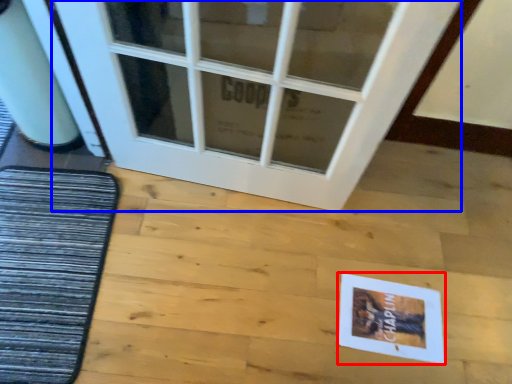
Question: Which point is closer to the camera, postcard (highlighted by a red box) or door (highlighted by a blue box)?

Choices:
 (A) postcard
 (B) door

Answer: (B)